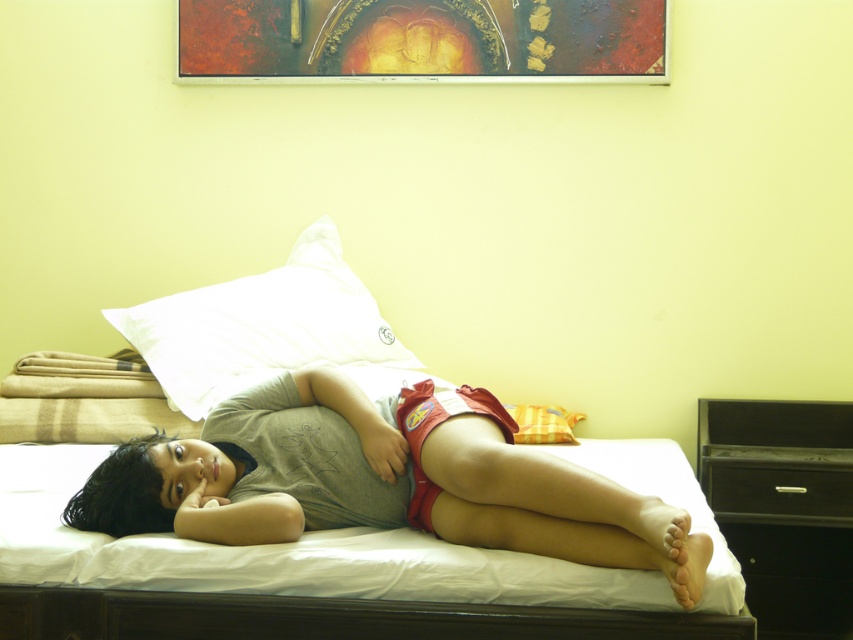
Is metallic gold picture frame at upper center positioned in front of white soft pillow at upper center?

No, it is behind white soft pillow at upper center.

Between metallic gold picture frame at upper center and white soft pillow at upper center, which one appears on the left side from the viewer's perspective?

white soft pillow at upper center is more to the left.

Which is behind, point (648, 29) or point (247, 333)?

Positioned behind is point (648, 29).

At what (x,y) coordinates should I click in order to perform the action: click on metallic gold picture frame at upper center. Please return your answer as a coordinate pair (x, y). Looking at the image, I should click on (421, 40).

Between black wood drawer at lower right and black matte drawer at lower right, which one is positioned lower?

Positioned lower is black wood drawer at lower right.

Between point (758, 513) and point (804, 508), which one is positioned behind?

Point (758, 513)

Where is `black wood drawer at lower right`? The height and width of the screenshot is (640, 853). black wood drawer at lower right is located at coordinates (784, 508).

Can you confirm if matte gray t-shirt at center is positioned below white soft pillow at upper center?

Yes, matte gray t-shirt at center is below white soft pillow at upper center.

Who is shorter, matte gray t-shirt at center or white soft pillow at upper center?

With less height is matte gray t-shirt at center.

Identify the location of matte gray t-shirt at center. This screenshot has height=640, width=853. (381, 481).